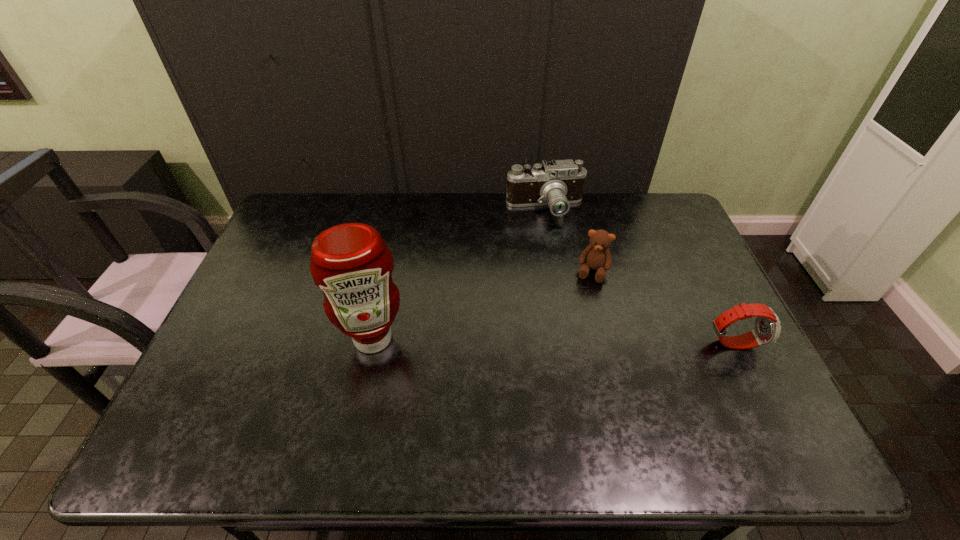
The width and height of the screenshot is (960, 540). Identify the location of condiment. (351, 263).

You are a GUI agent. You are given a task and a screenshot of the screen. Output one action in this format:
    pyautogui.click(x=<x>, y=<y>)
    Task: Click on the tallest object
    
    Given the screenshot: What is the action you would take?
    pyautogui.click(x=351, y=263)

Locate an element on the screen. watch is located at coordinates (766, 329).

You are a GUI agent. You are given a task and a screenshot of the screen. Output one action in this format:
    pyautogui.click(x=<x>, y=<y>)
    Task: Click on the teddy bear
    The width and height of the screenshot is (960, 540).
    Given the screenshot: What is the action you would take?
    tap(596, 256)

Identify the location of camera. (558, 183).

The image size is (960, 540). What are the coordinates of `vacant space located 0.240m on the left of the tallest object` in the screenshot? It's located at (249, 339).

Identify the location of vacant space positioned 0.310m on the face of the third nearest object. The image size is (960, 540). (567, 367).

I want to click on free space located 0.380m on the face of the third nearest object, so (561, 390).

You are a GUI agent. You are given a task and a screenshot of the screen. Output one action in this format:
    pyautogui.click(x=<x>, y=<y>)
    Task: Click on the vacant region located 0.330m on the face of the third nearest object
    This screenshot has width=960, height=540.
    Given the screenshot: What is the action you would take?
    pyautogui.click(x=565, y=374)

At what (x,y) coordinates should I click in order to perform the action: click on free location located 0.050m at the lens of the camera. Please return your answer as a coordinate pair (x, y). The height and width of the screenshot is (540, 960). Looking at the image, I should click on (548, 233).